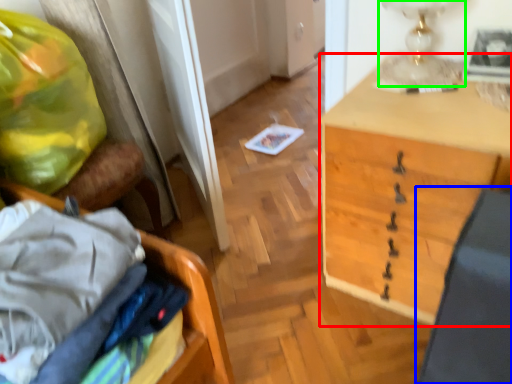
Question: Which object is positioned closest to desk (highlighted by a red box)? Select from swivel chair (highlighted by a blue box) and table lamp (highlighted by a green box).

Choices:
 (A) swivel chair
 (B) table lamp

Answer: (B)